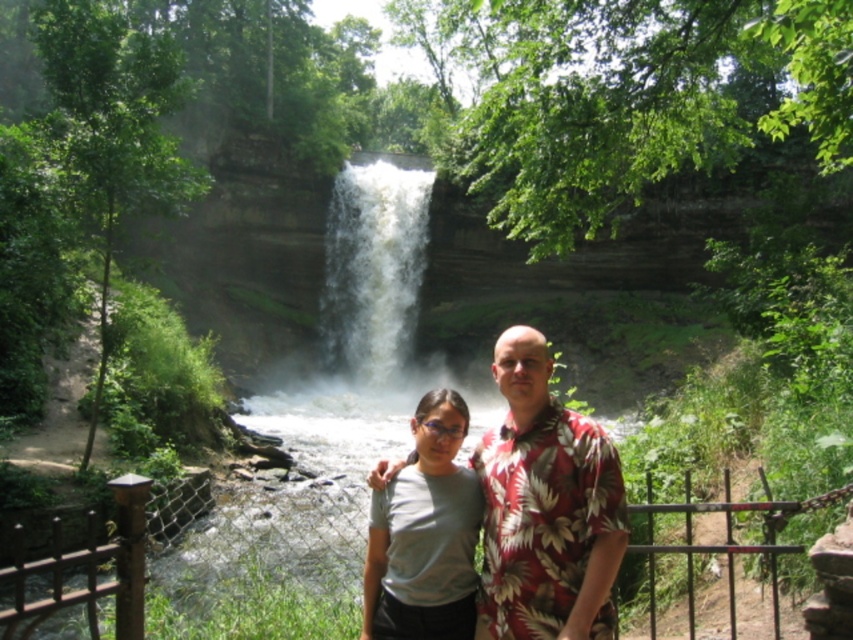
Question: Which object is farther from the camera taking this photo?

Choices:
 (A) white frothy water at center
 (B) floral print shirt at center

Answer: (A)

Question: Is floral print shirt at center further to the viewer compared to white frothy water at center?

Choices:
 (A) no
 (B) yes

Answer: (A)

Question: Can you confirm if floral print shirt at center is bigger than white frothy water at center?

Choices:
 (A) no
 (B) yes

Answer: (A)

Question: Which of the following is the farthest from the observer?

Choices:
 (A) gray matte t-shirt at center
 (B) floral print shirt at center
 (C) white frothy water at center

Answer: (C)

Question: Observing the image, what is the correct spatial positioning of floral print shirt at center in reference to gray matte t-shirt at center?

Choices:
 (A) left
 (B) right

Answer: (B)

Question: Which object is closer to the camera taking this photo?

Choices:
 (A) floral print shirt at center
 (B) gray matte t-shirt at center
 (C) white frothy water at center

Answer: (A)